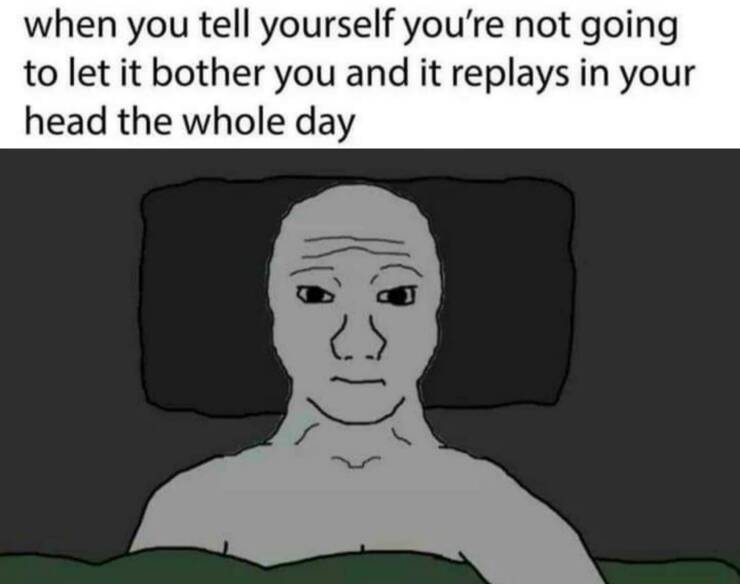
The height and width of the screenshot is (584, 740). I want to click on pillow, so click(x=447, y=378).